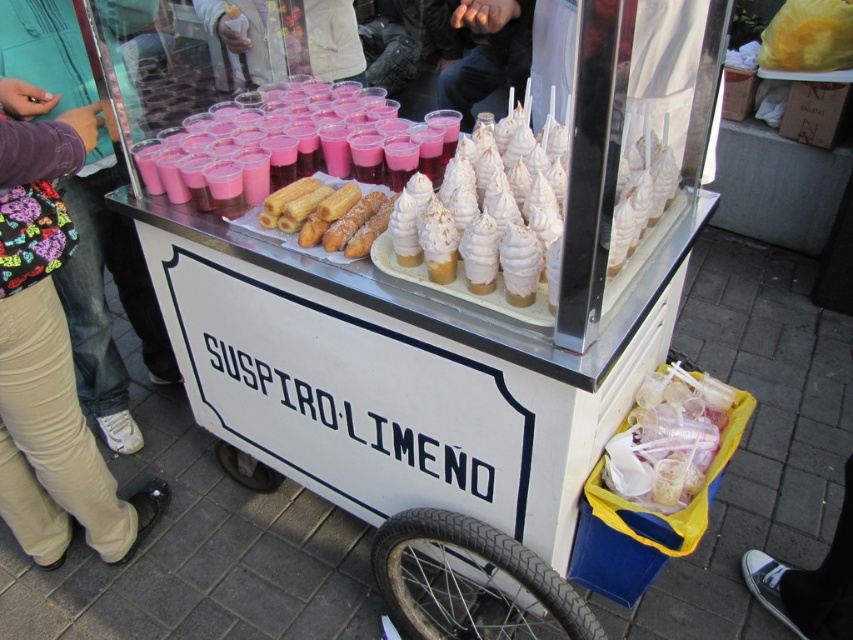
Based on the coordinates provided, which object is located at point (668, 440) in the image?

The clear plastic cups at lower right are located at point (668, 440).

You are a customer at the street food cart labeled SUSPIRO LIME. You want to order the white soft serve ice cream cone at center but need to avoid stepping on the tan pants at lower left. Based on their positions, can you reach the cone without stepping on the pants?

The tan pants at lower left is below the white soft serve ice cream cone at center, so you can reach the cone without stepping on the pants as long as you approach from the upper side.

Looking at this image, you are a customer at the food cart and want to know if the clear plastic cups at lower right can fit inside the white cotton shirt at upper center. Can they?

The clear plastic cups at lower right are thinner than the white cotton shirt at upper center, so they can fit inside the shirt.